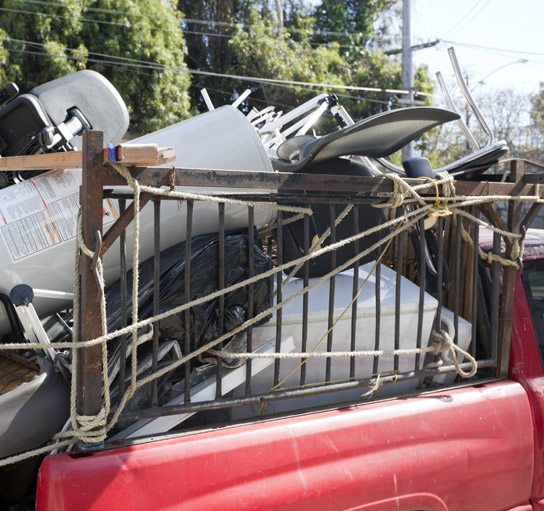
Where is `lamp`? The image size is (544, 511). lamp is located at coordinates (528, 60).